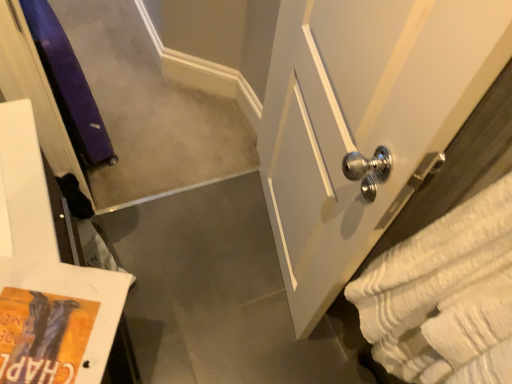
Question: Considering the positions of white textured bath towel at right and white glossy door at right in the image, is white textured bath towel at right bigger or smaller than white glossy door at right?

Choices:
 (A) big
 (B) small

Answer: (B)

Question: From a real-world perspective, is white textured bath towel at right above or below white glossy door at right?

Choices:
 (A) below
 (B) above

Answer: (B)

Question: Considering their positions, is white textured bath towel at right located in front of or behind white glossy door at right?

Choices:
 (A) front
 (B) behind

Answer: (A)

Question: Is white glossy door at right inside the boundaries of white textured bath towel at right, or outside?

Choices:
 (A) inside
 (B) outside

Answer: (B)

Question: Based on their sizes in the image, would you say white glossy door at right is bigger or smaller than white textured bath towel at right?

Choices:
 (A) small
 (B) big

Answer: (B)

Question: In terms of width, does white glossy door at right look wider or thinner when compared to white textured bath towel at right?

Choices:
 (A) thin
 (B) wide

Answer: (A)

Question: Is point (356, 145) closer or farther from the camera than point (472, 246)?

Choices:
 (A) farther
 (B) closer

Answer: (A)